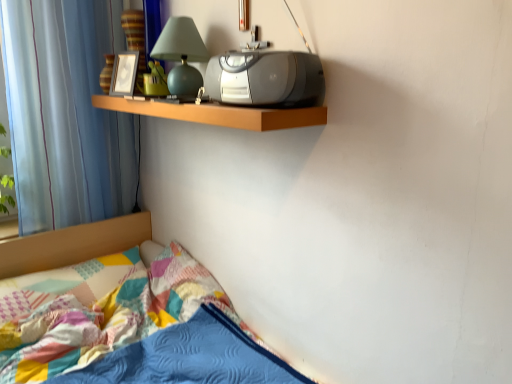
Question: From the image's perspective, relative to green rubber duck at upper center, is blue sheer curtain at left above or below?

Choices:
 (A) above
 (B) below

Answer: (B)

Question: Do you think blue sheer curtain at left is within green rubber duck at upper center, or outside of it?

Choices:
 (A) outside
 (B) inside

Answer: (A)

Question: Which is nearer to the matte green glass table lamp at upper center?

Choices:
 (A) wooden shelf at upper center
 (B) textured cotton quilt at lower left
 (C) blue sheer curtain at left
 (D) satin silver stereo at upper center
 (E) green rubber duck at upper center

Answer: (E)

Question: Which object is positioned closest to the matte green glass table lamp at upper center?

Choices:
 (A) blue sheer curtain at left
 (B) satin silver stereo at upper center
 (C) textured cotton quilt at lower left
 (D) green rubber duck at upper center
 (E) wooden shelf at upper center

Answer: (D)